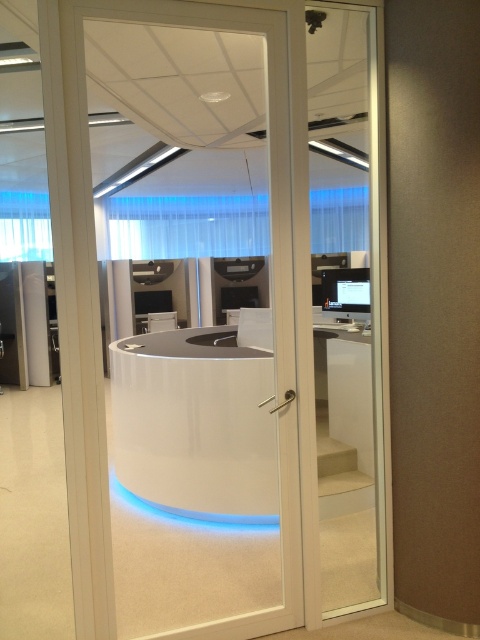
Between transparent glass door at center and matte black monitor at center, which one appears on the right side from the viewer's perspective?

transparent glass door at center

Is point (332, 417) farther from viewer compared to point (354, 314)?

No, it is in front of (354, 314).

Where is `transparent glass door at center`? The height and width of the screenshot is (640, 480). transparent glass door at center is located at coordinates (347, 305).